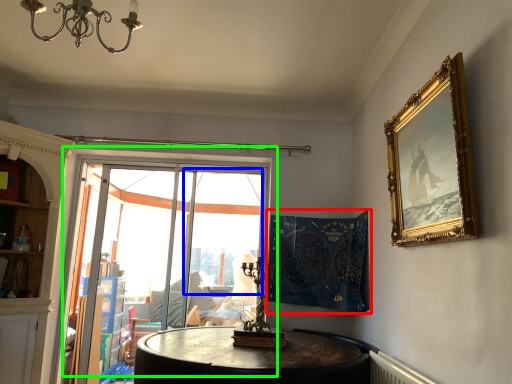
Question: Based on their relative distances, which object is nearer to tapestry (highlighted by a red box)? Choose from window screen (highlighted by a blue box) and window (highlighted by a green box).

Choices:
 (A) window screen
 (B) window

Answer: (B)